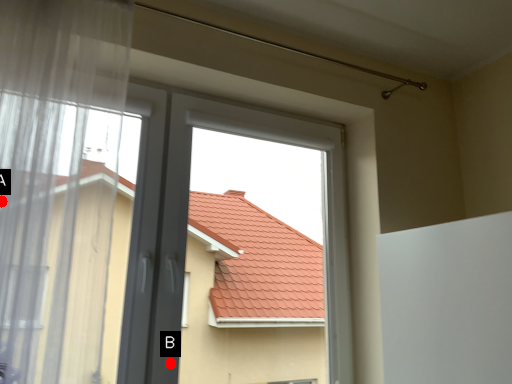
Question: Two points are circled on the image, labeled by A and B beside each circle. Which point is closer to the camera?

Choices:
 (A) A is closer
 (B) B is closer

Answer: (A)